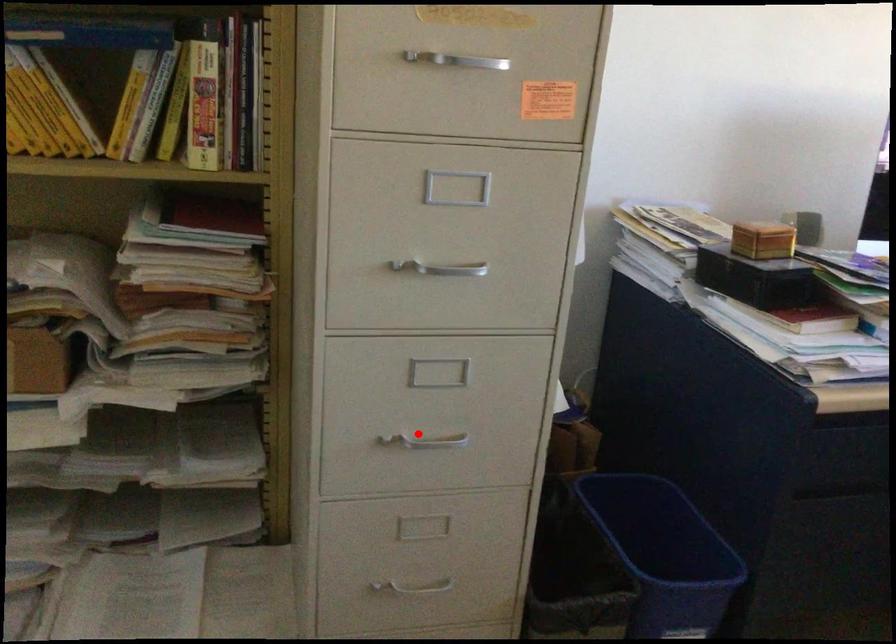
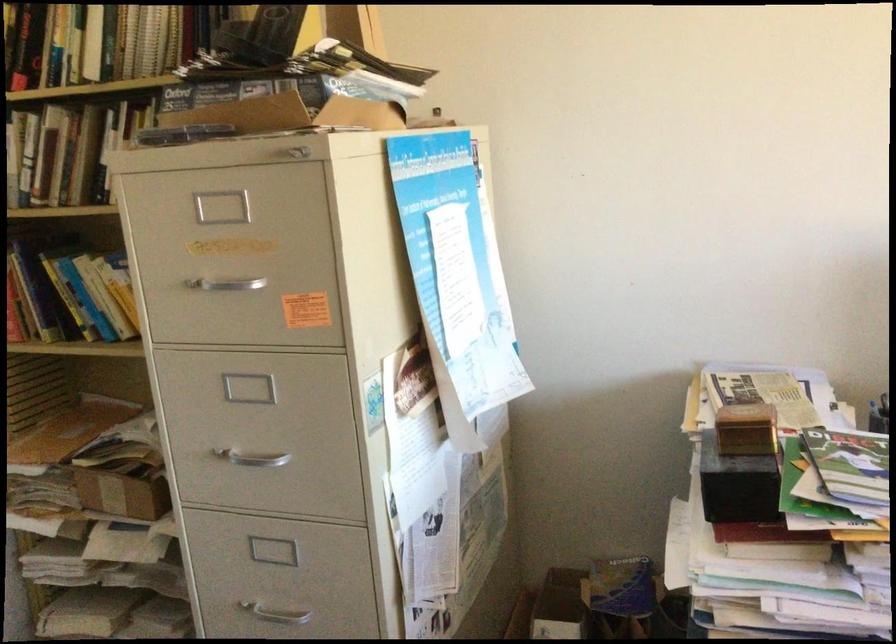
Find the pixel in the second image that matches the highlighted location in the first image.

(273, 608)